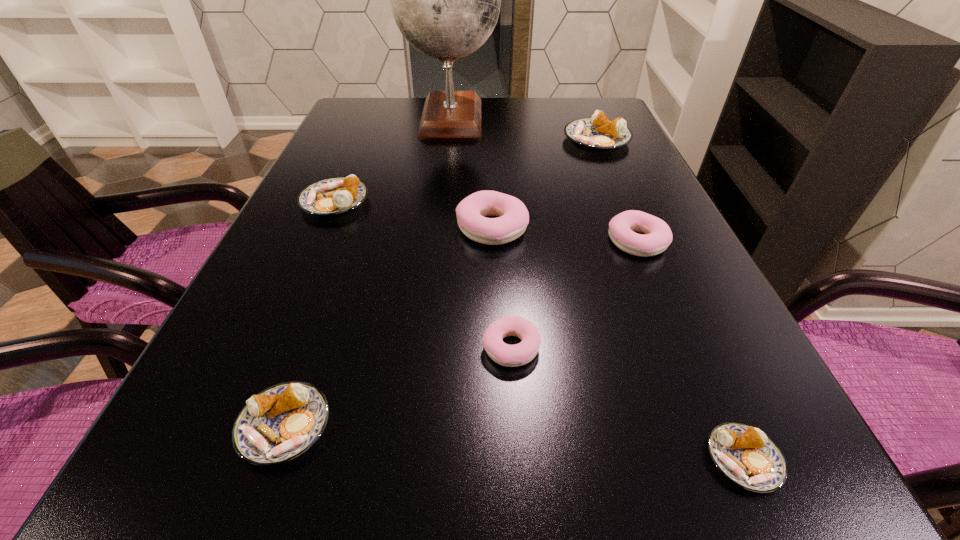
In order to click on the second closest pastry relative to the biggest brown pastry in this screenshot , I will do click(622, 227).

Select which brown pastry is the second closest to the biggest pink pastry. Please provide its 2D coordinates. Your answer should be formatted as a tuple, i.e. [(x, y)], where the tuple contains the x and y coordinates of a point satisfying the conditions above.

[(599, 133)]

Point out which brown pastry is positioned as the nearest to the biggest brown pastry. Please provide its 2D coordinates. Your answer should be formatted as a tuple, i.e. [(x, y)], where the tuple contains the x and y coordinates of a point satisfying the conditions above.

[(336, 195)]

You are a GUI agent. You are given a task and a screenshot of the screen. Output one action in this format:
    pyautogui.click(x=<x>, y=<y>)
    Task: Click on the pink pastry that stands as the second closest to the third biggest brown pastry
    The image size is (960, 540).
    Given the screenshot: What is the action you would take?
    pyautogui.click(x=513, y=217)

Locate which pink pastry is the second closest to the second smallest pink pastry. Please provide its 2D coordinates. Your answer should be formatted as a tuple, i.e. [(x, y)], where the tuple contains the x and y coordinates of a point satisfying the conditions above.

[(522, 353)]

Where is `vacant position in the image that satisfies the following two spatial constraints: 1. at the equator of the nearest pink pastry; 2. on the right side of the tallest object`? vacant position in the image that satisfies the following two spatial constraints: 1. at the equator of the nearest pink pastry; 2. on the right side of the tallest object is located at coordinates 425,347.

You are a GUI agent. You are given a task and a screenshot of the screen. Output one action in this format:
    pyautogui.click(x=<x>, y=<y>)
    Task: Click on the vacant space that satisfies the following two spatial constraints: 1. on the front side of the smallest brown pastry; 2. on the right side of the third biggest brown pastry
    
    Given the screenshot: What is the action you would take?
    pyautogui.click(x=273, y=460)

Find the location of a particular element. blank area in the image that satisfies the following two spatial constraints: 1. at the equator of the tallest object; 2. on the left side of the rightmost pink pastry is located at coordinates (437, 242).

Where is `vacant position in the image that satisfies the following two spatial constraints: 1. on the front side of the smallest brown pastry; 2. on the left side of the second biggest brown pastry`? The image size is (960, 540). vacant position in the image that satisfies the following two spatial constraints: 1. on the front side of the smallest brown pastry; 2. on the left side of the second biggest brown pastry is located at coordinates (224, 460).

I want to click on free location that satisfies the following two spatial constraints: 1. at the equator of the farthest pastry; 2. on the right side of the tallest object, so click(448, 140).